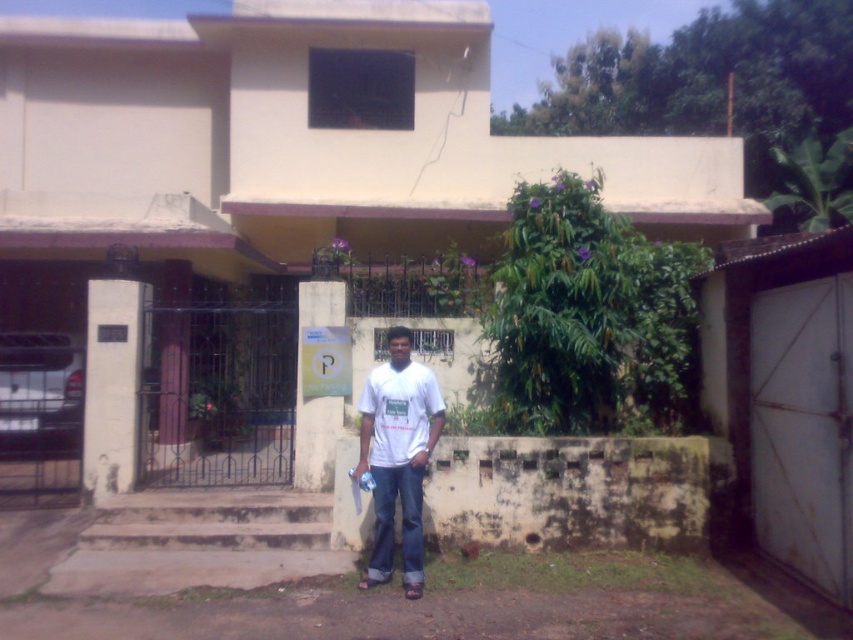
Locate an element on the screen. The width and height of the screenshot is (853, 640). concrete stairs at center is located at coordinates (199, 541).

Is point (283, 566) positioned behind point (416, 417)?

Yes, it is.

The height and width of the screenshot is (640, 853). I want to click on concrete stairs at center, so click(x=199, y=541).

Does point (425, 435) come closer to viewer compared to point (378, 394)?

No, (425, 435) is behind (378, 394).

Can you confirm if white matte shirt at center is taller than white matte t-shirt at center?

Yes, white matte shirt at center is taller than white matte t-shirt at center.

What do you see at coordinates (397, 456) in the screenshot?
I see `white matte shirt at center` at bounding box center [397, 456].

I want to click on white matte shirt at center, so click(397, 456).